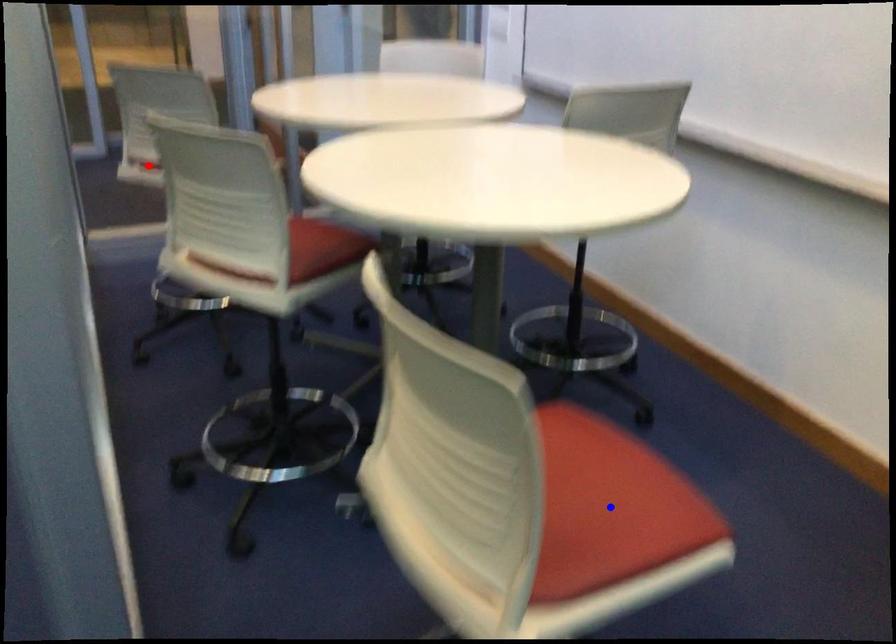
Question: Which of the two points in the image is closer to the camera?

Choices:
 (A) Blue point is closer.
 (B) Red point is closer.

Answer: (A)